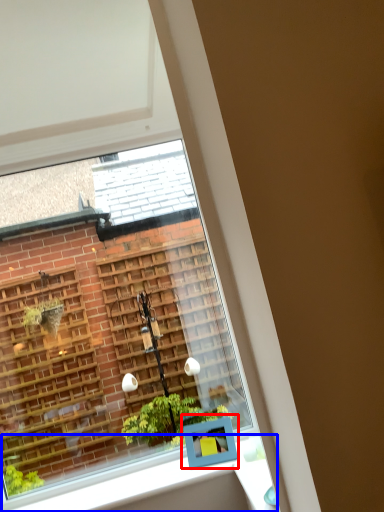
Question: Among these objects, which one is nearest to the camera, window box (highlighted by a red box) or window sill (highlighted by a blue box)?

Choices:
 (A) window box
 (B) window sill

Answer: (B)